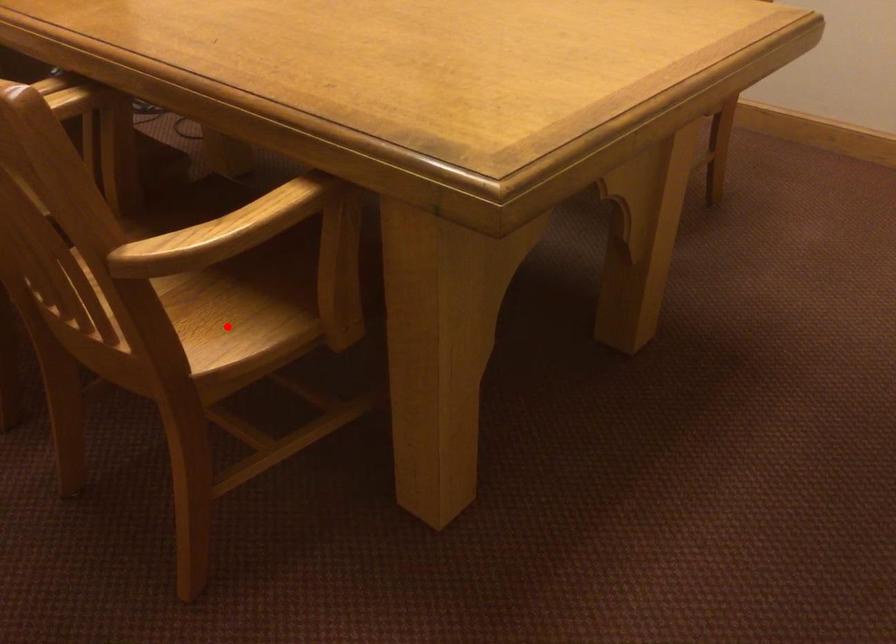
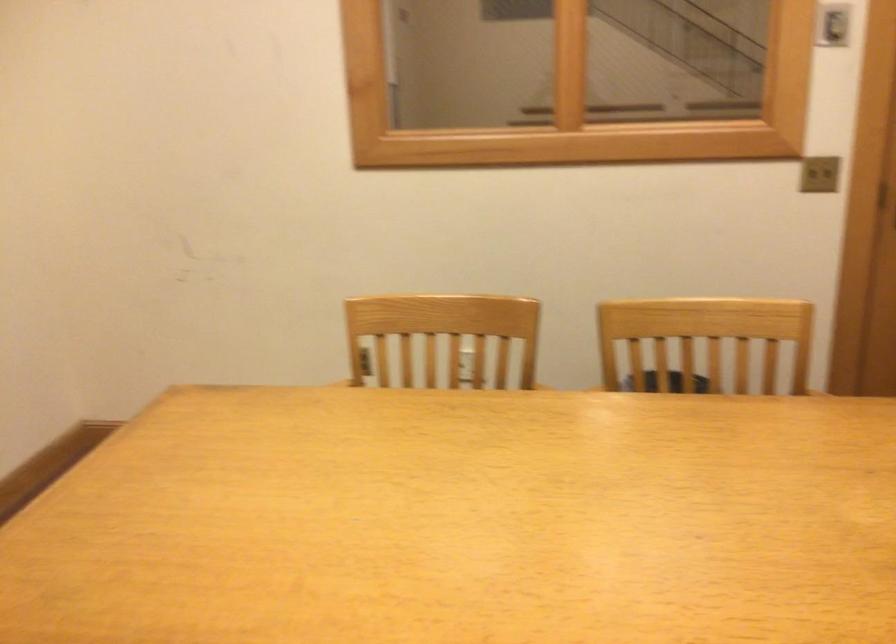
Question: I am providing you with two images of the same scene from different viewpoints. A red point is marked on the first image. At the location where the point appears in image 1, is it still visible in image 2?

Choices:
 (A) Yes
 (B) No

Answer: (B)